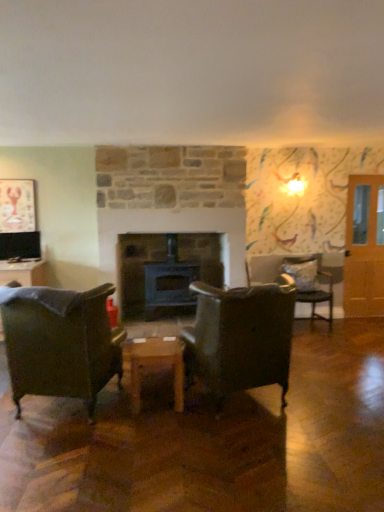
Question: Is metallic lobster picture frame at upper left closer to camera compared to gray fabric pillow at right?

Choices:
 (A) yes
 (B) no

Answer: (A)

Question: From the image's perspective, is metallic lobster picture frame at upper left below gray fabric pillow at right?

Choices:
 (A) no
 (B) yes

Answer: (A)

Question: Considering the relative sizes of metallic lobster picture frame at upper left and gray fabric pillow at right in the image provided, is metallic lobster picture frame at upper left shorter than gray fabric pillow at right?

Choices:
 (A) no
 (B) yes

Answer: (A)

Question: Is metallic lobster picture frame at upper left directly adjacent to gray fabric pillow at right?

Choices:
 (A) yes
 (B) no

Answer: (B)

Question: From a real-world perspective, is metallic lobster picture frame at upper left located higher than gray fabric pillow at right?

Choices:
 (A) no
 (B) yes

Answer: (B)

Question: Is metallic lobster picture frame at upper left wider than gray fabric pillow at right?

Choices:
 (A) no
 (B) yes

Answer: (A)

Question: Considering the relative sizes of gray fabric pillow at right and black matte fireplace at center in the image provided, is gray fabric pillow at right thinner than black matte fireplace at center?

Choices:
 (A) no
 (B) yes

Answer: (B)

Question: Does gray fabric pillow at right have a greater height compared to black matte fireplace at center?

Choices:
 (A) no
 (B) yes

Answer: (A)

Question: From a real-world perspective, is gray fabric pillow at right positioned under black matte fireplace at center based on gravity?

Choices:
 (A) yes
 (B) no

Answer: (A)

Question: From the image's perspective, is gray fabric pillow at right located above black matte fireplace at center?

Choices:
 (A) yes
 (B) no

Answer: (B)

Question: Considering the relative positions of gray fabric pillow at right and black matte fireplace at center in the image provided, is gray fabric pillow at right to the right of black matte fireplace at center from the viewer's perspective?

Choices:
 (A) yes
 (B) no

Answer: (A)

Question: Can you confirm if gray fabric pillow at right is bigger than black matte fireplace at center?

Choices:
 (A) no
 (B) yes

Answer: (A)

Question: Is the surface of leather at center, which appears as the 1th chair when viewed from the front, in direct contact with black matte fireplace at center?

Choices:
 (A) yes
 (B) no

Answer: (B)